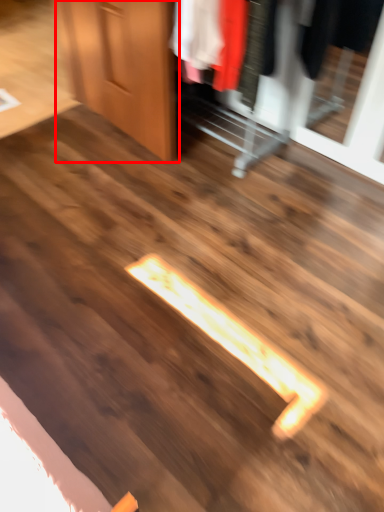
Question: From the image's perspective, what is the correct spatial relationship of door (annotated by the red box) in relation to dresser?

Choices:
 (A) above
 (B) below

Answer: (A)